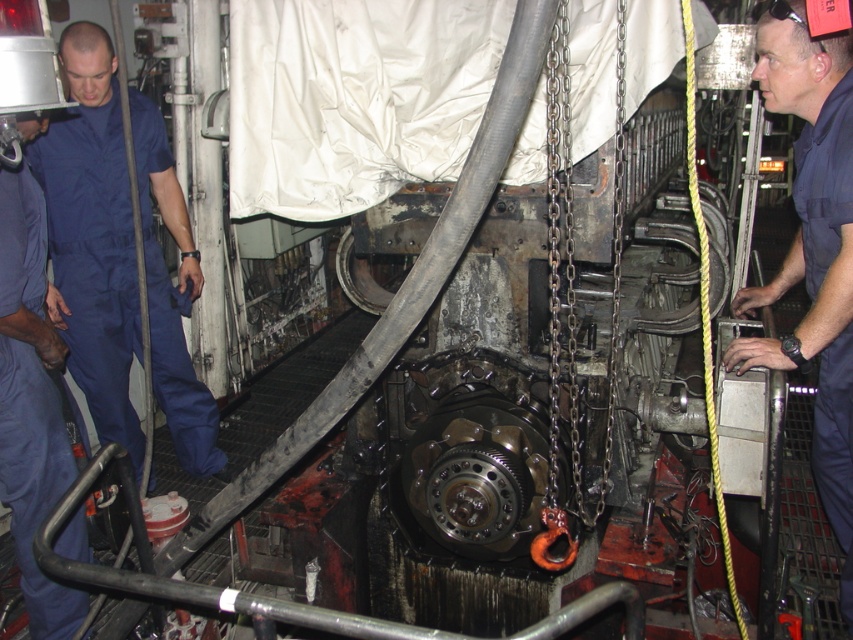
Question: Which object appears closest to the camera in this image?

Choices:
 (A) blue cotton jumpsuit at left
 (B) dark blue uniform at center

Answer: (B)

Question: Can you confirm if blue cotton jumpsuit at left is wider than dark blue uniform at center?

Choices:
 (A) no
 (B) yes

Answer: (A)

Question: Considering the relative positions of blue cotton jumpsuit at left and dark blue uniform at center in the image provided, where is blue cotton jumpsuit at left located with respect to dark blue uniform at center?

Choices:
 (A) below
 (B) above

Answer: (B)

Question: Which of the following is the closest to the observer?

Choices:
 (A) (138, 337)
 (B) (834, 492)

Answer: (B)

Question: Which of the following is the closest to the observer?

Choices:
 (A) (96, 374)
 (B) (816, 460)

Answer: (B)

Question: Can you confirm if blue cotton jumpsuit at left is positioned to the left of dark blue uniform at center?

Choices:
 (A) yes
 (B) no

Answer: (A)